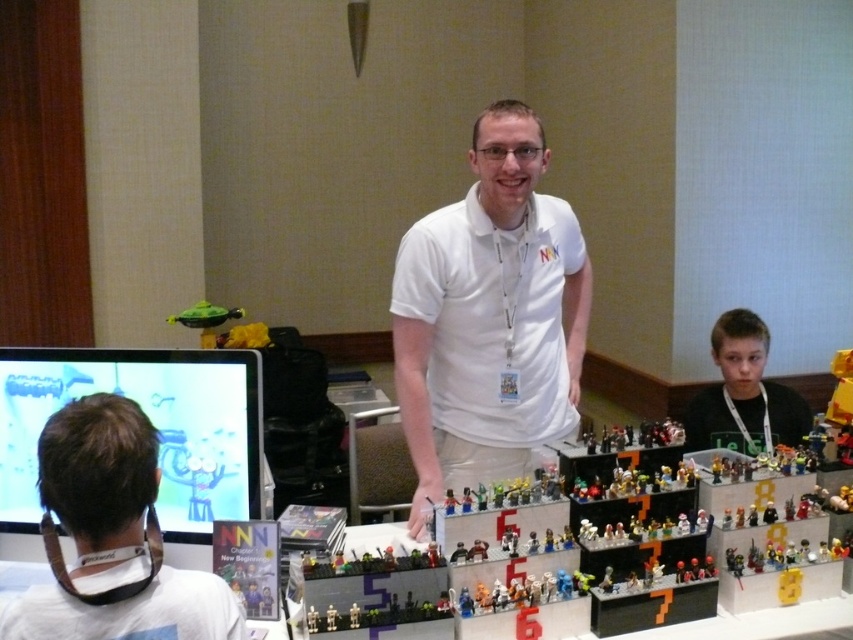
What do you see at coordinates (151, 422) in the screenshot? This screenshot has width=853, height=640. I see `matte plastic monitor at left` at bounding box center [151, 422].

Is matte plastic monitor at left shorter than smooth black shirt at lower right?

Yes.

This screenshot has height=640, width=853. What do you see at coordinates (151, 422) in the screenshot? I see `matte plastic monitor at left` at bounding box center [151, 422].

Locate an element on the screen. matte plastic monitor at left is located at coordinates (151, 422).

Who is taller, white matte shirt at center or smooth black shirt at lower right?

white matte shirt at center

Describe the element at coordinates (489, 317) in the screenshot. I see `white matte shirt at center` at that location.

I want to click on white matte shirt at center, so click(489, 317).

Does white matte shirt at center have a smaller size compared to matte plastic monitor at left?

No, white matte shirt at center is not smaller than matte plastic monitor at left.

Can you confirm if white matte shirt at center is shorter than matte plastic monitor at left?

No.

Between point (488, 337) and point (227, 424), which one is positioned behind?

Point (488, 337)

The height and width of the screenshot is (640, 853). Identify the location of white matte shirt at center. (489, 317).